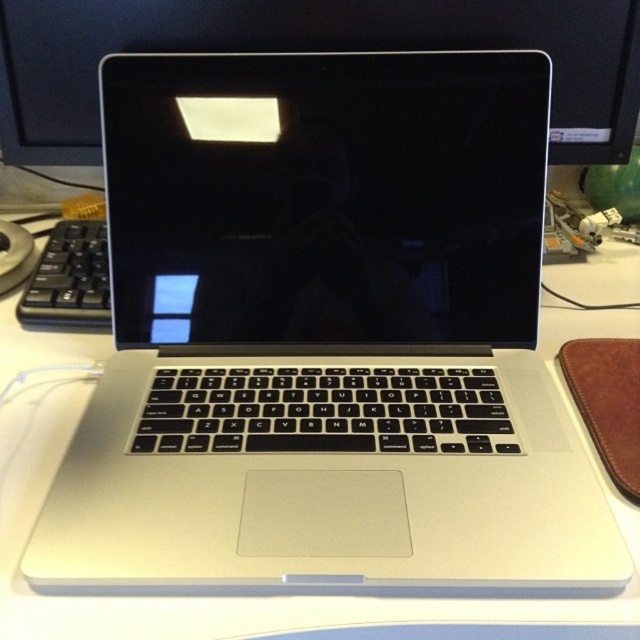
You are setting up a new monitor and keyboard on your desk. The satin black monitor at center needs to be placed so it doesn not block the view of the black matte keyboard at left. Given their sizes, is this arrangement possible?

The satin black monitor at center has a greater height compared to black matte keyboard at left. Since the monitor is taller, it might block the view of the keyboard if placed directly in front of it. To avoid blocking, position the monitor to the side or adjust their placement so the keyboard remains visible.

Consider the image. You are standing in an office and see the laptop on the desk. There is a point labeled at coordinates (x=310, y=51). What object is located at that point?

The point at coordinates (x=310, y=51) corresponds to the satin black monitor at center.

You are setting up a new desk arrangement and want to place a cup between the satin black monitor at center and the black matte keyboard at left. Based on their positions, where should you place the cup so it is between both objects?

The satin black monitor at center is in front of the black matte keyboard at left, so placing the cup in front of the monitor and behind the keyboard would position it between both objects.